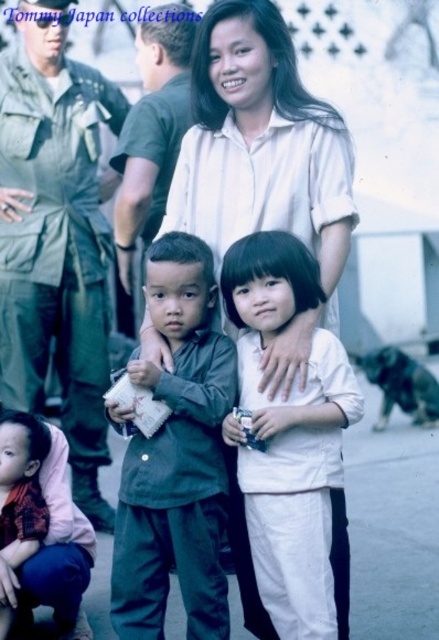
In the scene shown: Can you confirm if dark green fabric shirt at center is shorter than white matte shirt at center?

Yes, dark green fabric shirt at center is shorter than white matte shirt at center.

Does dark green fabric shirt at center appear over white matte shirt at center?

Correct, dark green fabric shirt at center is located above white matte shirt at center.

Image resolution: width=439 pixels, height=640 pixels. In order to click on dark green fabric shirt at center in this screenshot , I will do `click(176, 458)`.

This screenshot has height=640, width=439. What are the coordinates of `dark green fabric shirt at center` in the screenshot? It's located at (176, 458).

Is white cotton shirt at center thinner than green military uniform at center?

In fact, white cotton shirt at center might be wider than green military uniform at center.

Based on the photo, who is positioned more to the left, white cotton shirt at center or green military uniform at center?

Positioned to the left is green military uniform at center.

The image size is (439, 640). I want to click on white cotton shirt at center, so click(263, 163).

Who is positioned more to the right, green military uniform at center or soft pink fabric at lower left?

soft pink fabric at lower left

Is green military uniform at center wider than soft pink fabric at lower left?

Correct, the width of green military uniform at center exceeds that of soft pink fabric at lower left.

What are the coordinates of `green military uniform at center` in the screenshot? It's located at (56, 236).